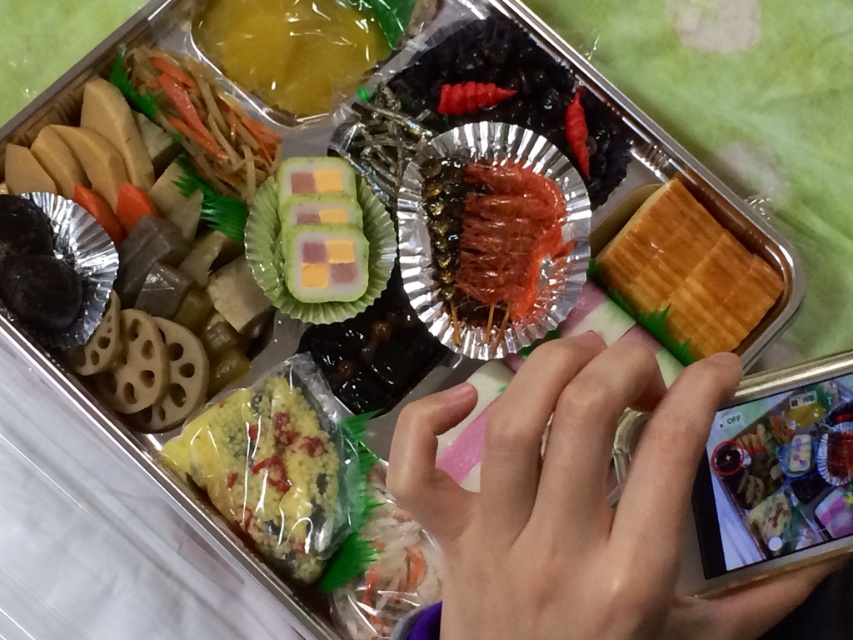
Is pale skin at center thinner than shiny red skewered shrimp at center?

No.

Between pale skin at center and shiny red skewered shrimp at center, which one has more height?

pale skin at center

Is point (672, 520) in front of point (521, 291)?

Yes, it is.

The image size is (853, 640). I want to click on pale skin at center, so pos(578,502).

Does point (238, 456) come in front of point (314, 0)?

Yes, point (238, 456) is in front of point (314, 0).

Who is shorter, yellow rice at center or yellow translucent gelatin at upper left?

yellow translucent gelatin at upper left

Does point (323, 540) lie in front of point (335, 26)?

That is True.

Locate an element on the screen. The image size is (853, 640). yellow rice at center is located at coordinates (270, 468).

Can you confirm if yellow rice at center is smaller than golden waffle at right?

Indeed, yellow rice at center has a smaller size compared to golden waffle at right.

Locate an element on the screen. yellow rice at center is located at coordinates click(x=270, y=468).

At what (x,y) coordinates should I click in order to perform the action: click on yellow rice at center. Please return your answer as a coordinate pair (x, y). The width and height of the screenshot is (853, 640). Looking at the image, I should click on (270, 468).